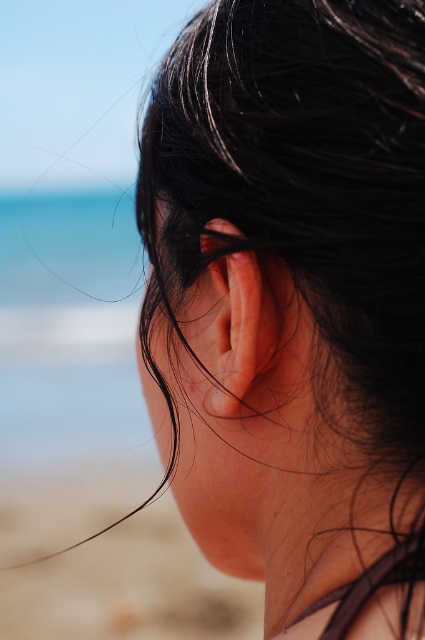
Can you confirm if black shiny hair at center is taller than pink flesh-colored ear at center?

Indeed, black shiny hair at center has a greater height compared to pink flesh-colored ear at center.

Is black shiny hair at center in front of pink flesh-colored ear at center?

→ Yes, it is.

Who is more forward, (173,419) or (237,314)?

Point (237,314)

This screenshot has height=640, width=425. Find the location of `black shiny hair at center`. black shiny hair at center is located at coordinates (292, 304).

Which is above, black shiny hair at center or beige sand at lower left?

black shiny hair at center is above.

Can you confirm if black shiny hair at center is taller than beige sand at lower left?

No, black shiny hair at center is not taller than beige sand at lower left.

What do you see at coordinates (292, 304) in the screenshot? I see `black shiny hair at center` at bounding box center [292, 304].

The height and width of the screenshot is (640, 425). Find the location of `black shiny hair at center`. black shiny hair at center is located at coordinates (292, 304).

Is beige sand at lower left shorter than pink flesh-colored ear at center?

Incorrect, beige sand at lower left's height does not fall short of pink flesh-colored ear at center's.

I want to click on beige sand at lower left, so click(130, 588).